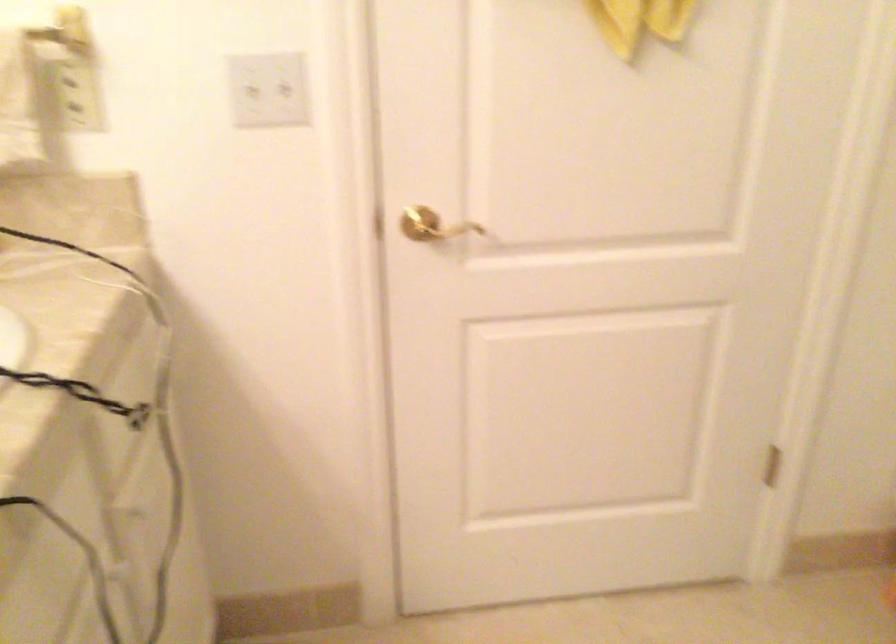
The image size is (896, 644). I want to click on gold door handle, so click(x=433, y=225).